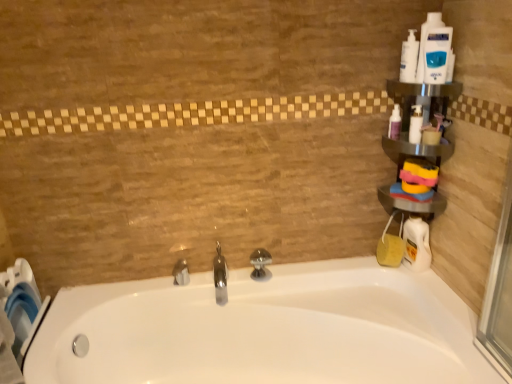
Question: Based on their sizes in the image, would you say translucent plastic bottle at upper right, positioned as the 3th cleaning product in top-to-bottom order, is bigger or smaller than white glossy bathtub at center?

Choices:
 (A) small
 (B) big

Answer: (A)

Question: From the image's perspective, is translucent plastic bottle at upper right, arranged as the 3th cleaning product when ordered from the bottom, located above or below white glossy bathtub at center?

Choices:
 (A) below
 (B) above

Answer: (B)

Question: Which object is positioned farthest from the white glossy bottle at upper right, placed as the 2th cleaning product when sorted from top to bottom?

Choices:
 (A) silver metallic tap at center, which is counted as the 3th tap, starting from the right
 (B) metallic silver shelf at upper right
 (C) white plastic bottle at upper right, the second cleaning product when ordered from bottom to top
 (D) white glossy bathtub at center
 (E) polished chrome tap at center, positioned as the 1th tap in right-to-left order

Answer: (A)

Question: Which object is the closest to the white glossy bottle at upper right, which is the 4th cleaning product from bottom to top?

Choices:
 (A) polished chrome tap at center, arranged as the third tap when viewed from the left
 (B) white plastic bottle at upper right
 (C) white plastic bottle at upper right, arranged as the fifth cleaning product when ordered from the bottom
 (D) white plastic bottle at upper right, the 4th cleaning product viewed from the top
 (E) polished chrome faucet at center, marked as the second tap in a right-to-left arrangement

Answer: (B)